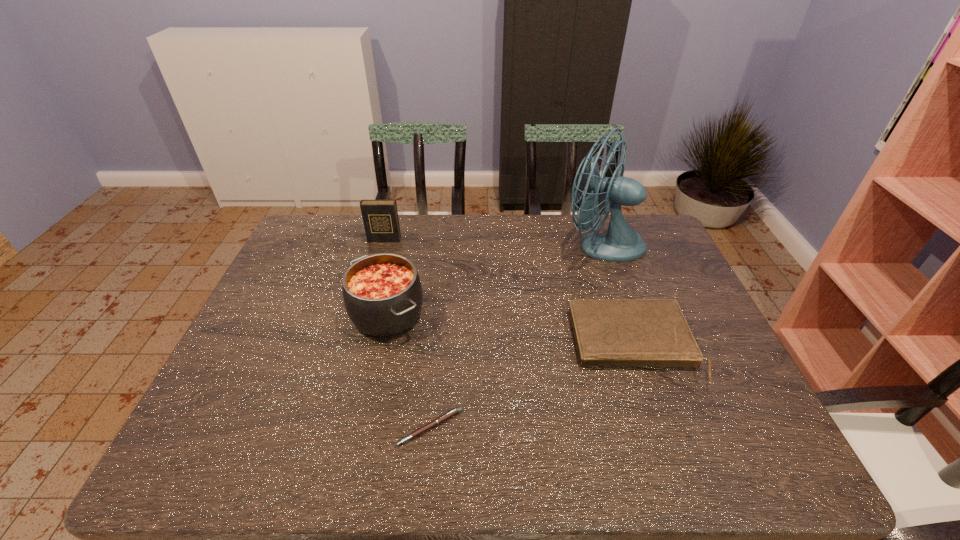
Locate an element on the screen. the tallest object is located at coordinates (621, 243).

Where is `diary`? diary is located at coordinates (380, 217).

Where is `casserole`? casserole is located at coordinates coord(382,292).

Identify the location of the fourth tallest object. (647, 333).

Where is `pen`? The height and width of the screenshot is (540, 960). pen is located at coordinates (448, 415).

Image resolution: width=960 pixels, height=540 pixels. Identify the location of the shortest object. (448, 415).

Locate an element on the screen. free space located in front of the tallest object to blow air is located at coordinates (466, 245).

The height and width of the screenshot is (540, 960). In order to click on free space located 0.310m in front of the tallest object to blow air in this screenshot , I will do `click(466, 245)`.

What are the coordinates of `free point located in front of the tallest object to blow air` in the screenshot? It's located at (472, 245).

Locate an element on the screen. This screenshot has width=960, height=540. free location located on the front cover of the diary is located at coordinates (379, 255).